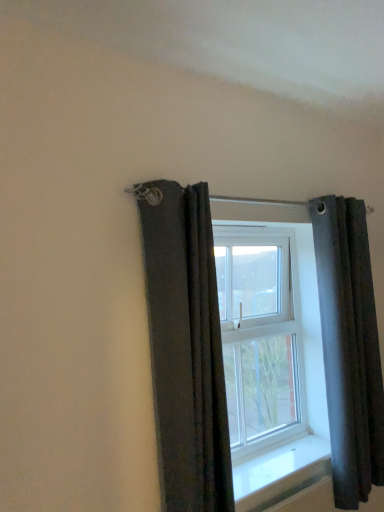
Question: Is dark gray fabric curtain at right, which is the 2th curtain in left-to-right order, bigger or smaller than white glossy window sill at center?

Choices:
 (A) big
 (B) small

Answer: (A)

Question: From a real-world perspective, is dark gray fabric curtain at right, which is the 2th curtain in left-to-right order, positioned above or below white glossy window sill at center?

Choices:
 (A) below
 (B) above

Answer: (B)

Question: Estimate the real-world distances between objects in this image. Which object is closer to the clear glass window at center?

Choices:
 (A) white glossy window sill at center
 (B) dark gray fabric curtain at right, the 1th curtain positioned from the right
 (C) dark gray fabric curtain at upper left, the 2th curtain positioned from the back

Answer: (B)

Question: Which is farther from the white glossy window sill at center?

Choices:
 (A) clear glass window at center
 (B) dark gray fabric curtain at right, marked as the first curtain in a back-to-front arrangement
 (C) dark gray fabric curtain at upper left, the 1th curtain when ordered from left to right

Answer: (C)